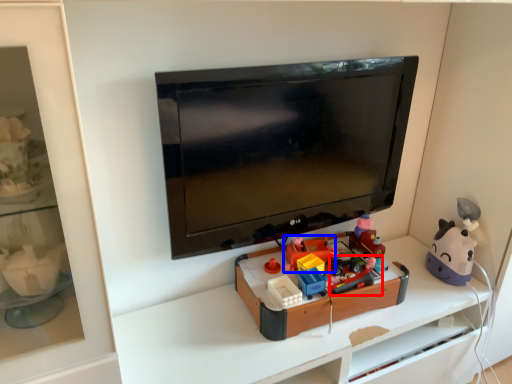
Question: Which object is further to the camera taking this photo, toy (highlighted by a red box) or toy (highlighted by a blue box)?

Choices:
 (A) toy
 (B) toy

Answer: (B)